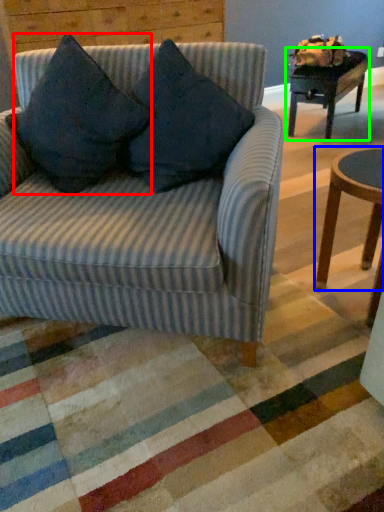
Question: Which object is the farthest from throw pillow (highlighted by a red box)? Choose among these: coffee table (highlighted by a blue box) or table (highlighted by a green box).

Choices:
 (A) coffee table
 (B) table

Answer: (B)